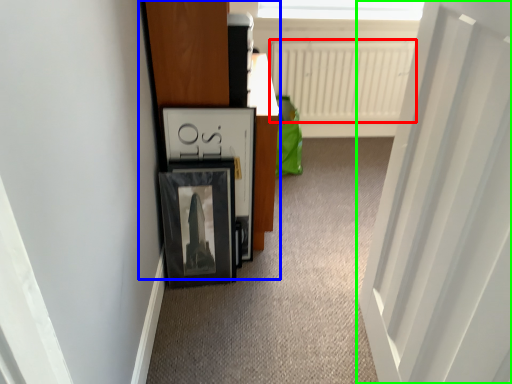
Question: Which is farther away from radiator (highlighted by a red box)? dresser (highlighted by a blue box) or door (highlighted by a green box)?

Choices:
 (A) dresser
 (B) door

Answer: (B)